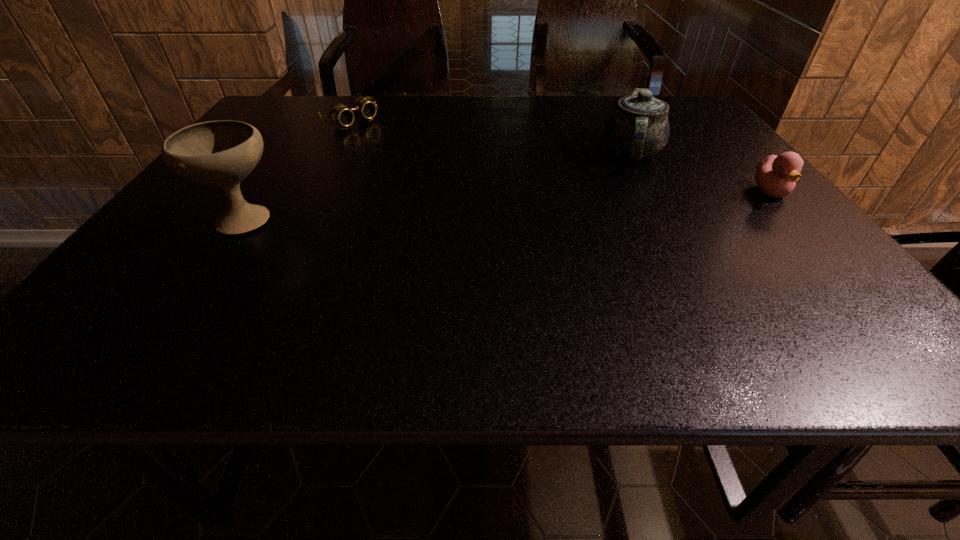
Image resolution: width=960 pixels, height=540 pixels. In order to click on vacant area at the right edge in this screenshot , I will do `click(780, 218)`.

Locate an element on the screen. The height and width of the screenshot is (540, 960). free region at the far left corner of the desktop is located at coordinates (294, 104).

What are the coordinates of `free space at the near left corner of the desktop` in the screenshot? It's located at (102, 301).

The height and width of the screenshot is (540, 960). Identify the location of vacant space at the far right corner of the desktop. (670, 99).

The image size is (960, 540). What are the coordinates of `vacant point located between the second object from right to left and the shortest object` in the screenshot? It's located at (492, 137).

Find the location of a particular element. empty space that is in between the chalice and the goggles is located at coordinates (298, 170).

At what (x,y) coordinates should I click in order to perform the action: click on vacant space that is in between the chinaware and the shortest object. Please return your answer as a coordinate pair (x, y). This screenshot has height=540, width=960. Looking at the image, I should click on (492, 137).

Locate an element on the screen. vacant space in between the second tallest object and the third tallest object is located at coordinates (702, 172).

Locate an element on the screen. free point between the rightmost object and the chalice is located at coordinates (508, 205).

This screenshot has width=960, height=540. Find the location of `vacant area between the shortest object and the chalice`. vacant area between the shortest object and the chalice is located at coordinates (298, 170).